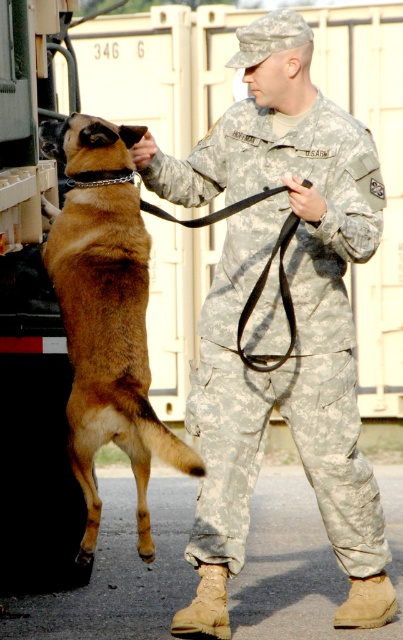
Image resolution: width=403 pixels, height=640 pixels. Describe the element at coordinates (297, 324) in the screenshot. I see `camouflage fabric uniform at center` at that location.

Between camouflage fabric uniform at center and brown fur dog at center, which one appears on the left side from the viewer's perspective?

Positioned to the left is brown fur dog at center.

The width and height of the screenshot is (403, 640). Describe the element at coordinates (297, 324) in the screenshot. I see `camouflage fabric uniform at center` at that location.

I want to click on camouflage fabric uniform at center, so tap(297, 324).